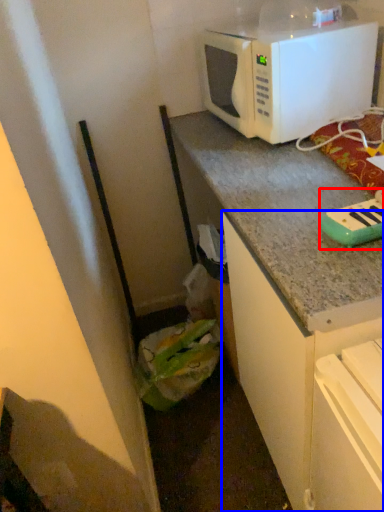
Question: Among these objects, which one is farthest to the camera, appliance (highlighted by a red box) or cabinetry (highlighted by a blue box)?

Choices:
 (A) appliance
 (B) cabinetry

Answer: (B)